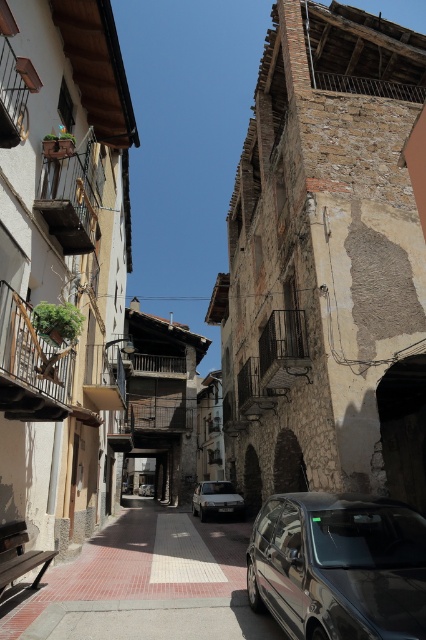
Is glossy metallic van at lower right taller than silver metallic car at center?

Yes.

I want to click on glossy metallic van at lower right, so pyautogui.click(x=339, y=566).

Who is higher up, smooth concrete pavement at center or glossy metallic van at lower right?

glossy metallic van at lower right

How distant is smooth concrete pavement at center from glossy metallic van at lower right?

8.53 feet

Locate an element on the screen. smooth concrete pavement at center is located at coordinates (143, 584).

Is point (229, 636) closer to camera compared to point (222, 502)?

Yes, it is.

Can you confirm if smooth concrete pavement at center is smaller than silver metallic car at center?

No, smooth concrete pavement at center is not smaller than silver metallic car at center.

Consider the image. Who is more distant from viewer, (147, 525) or (207, 490)?

The point (207, 490) is more distant.

Find the location of a particular element. smooth concrete pavement at center is located at coordinates (143, 584).